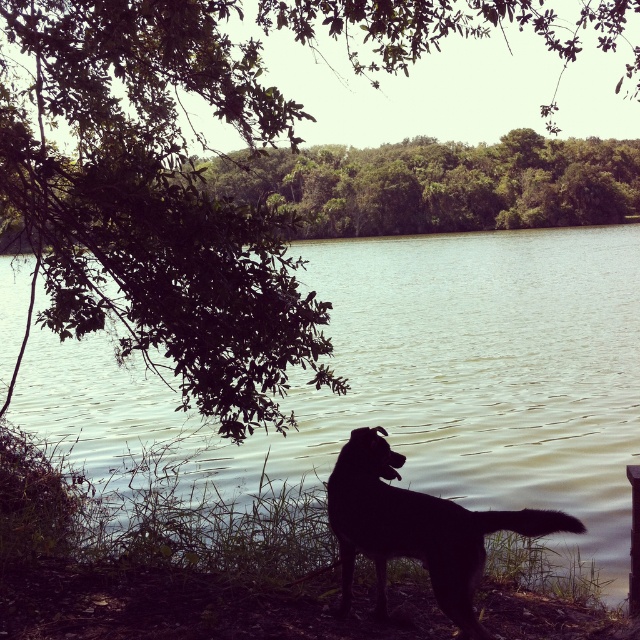
You are a photographer wanting to capture the black fur dog at lower center and the smooth water at center in the same frame. Based on their sizes in the image, which one appears larger?

The smooth water at center is taller than black fur dog at lower center, so the smooth water at center appears larger in the image.

You are standing at the lakeside and see the green leafy tree at upper left and the black fur dog at lower center. Which object is positioned to the left side of the other?

The green leafy tree at upper left is positioned to the left of the black fur dog at lower center.